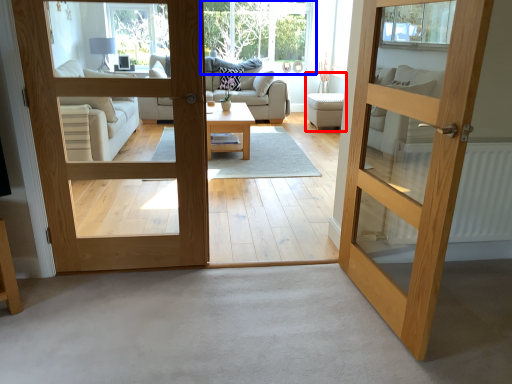
Question: Which of the following is the farthest to the observer, armchair (highlighted by a red box) or window (highlighted by a blue box)?

Choices:
 (A) armchair
 (B) window

Answer: (B)